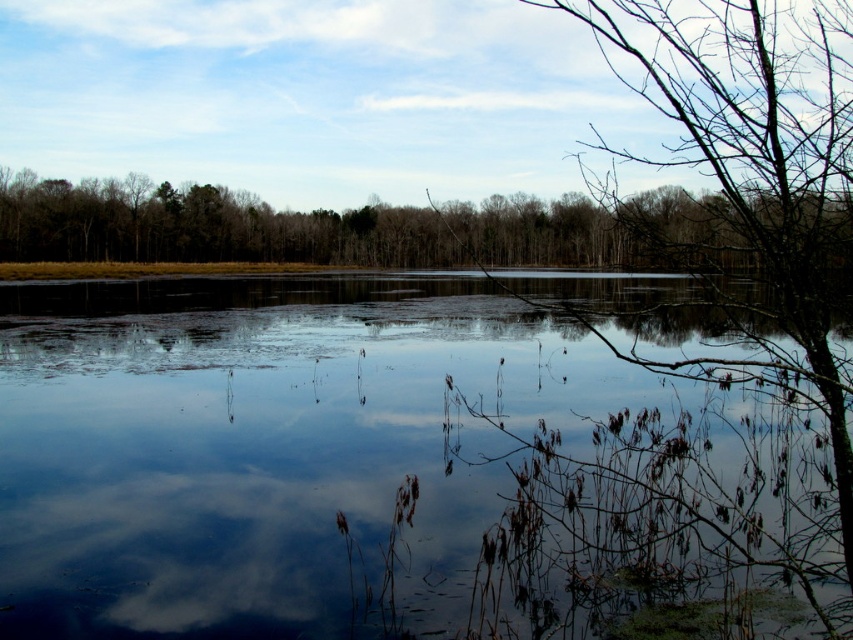
Question: Which of the following is the closest to the observer?

Choices:
 (A) (776, 353)
 (B) (6, 300)
 (C) (340, 221)

Answer: (A)

Question: Which is farther from the green leafy tree at right?

Choices:
 (A) transparent water at center
 (B) green matte trees at upper center

Answer: (A)

Question: Is the position of transparent water at center less distant than that of green leafy tree at right?

Choices:
 (A) no
 (B) yes

Answer: (A)

Question: Which point is closer to the camera taking this photo?

Choices:
 (A) (761, 88)
 (B) (73, 476)

Answer: (A)

Question: Does transparent water at center appear over green matte trees at upper center?

Choices:
 (A) no
 (B) yes

Answer: (A)

Question: Can you confirm if green leafy tree at right is smaller than green matte trees at upper center?

Choices:
 (A) no
 (B) yes

Answer: (A)